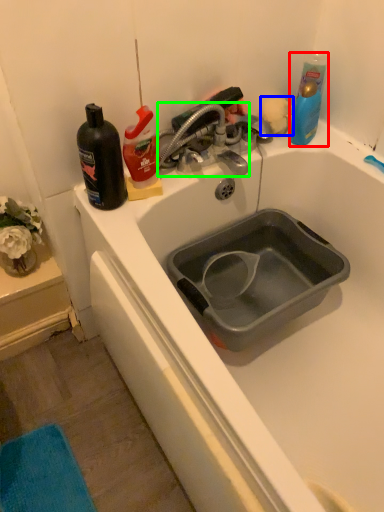
Question: Which object is the closest to the cleaning product (highlighted by a red box)? Choose among these: flower (highlighted by a blue box) or tap (highlighted by a green box).

Choices:
 (A) flower
 (B) tap

Answer: (A)